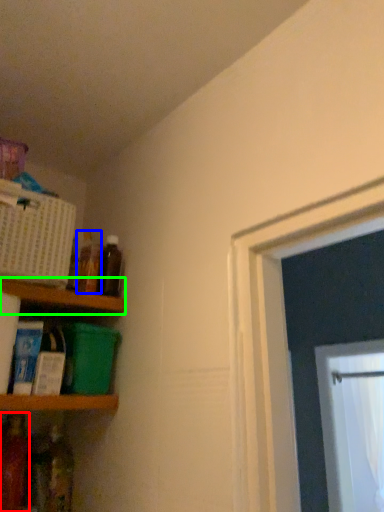
Question: Estimate the real-world distances between objects in this image. Which object is closer to bottle (highlighted by a red box), bottle (highlighted by a blue box) or shelf (highlighted by a green box)?

Choices:
 (A) bottle
 (B) shelf

Answer: (B)